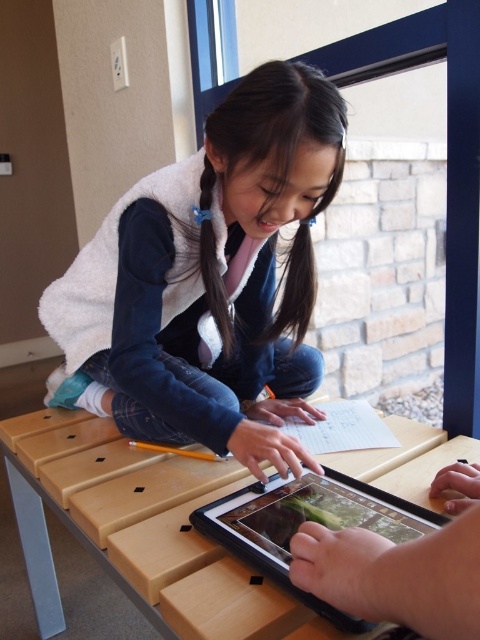
You are a student who needs to place a textbook on the wooden table at center. However, there is a black glossy tablet at lower center already on it. Can you place the textbook there without moving the tablet?

The wooden table at center is below the black glossy tablet at lower center, meaning the tablet is placed on top of the table. Therefore, you can place the textbook on the wooden table at center alongside the tablet as long as there is enough space.

You are trying to determine if the white fleece vest at center can be placed on top of the wooden table at center. Based on their thickness, can the vest fit on the table?

The white fleece vest at center is thinner than the wooden table at center, so it can fit on top of the wooden table at center since its thickness is less than the table.

You are a student who needs to place a notebook on the wooden table at center and the black glossy tablet at lower center. Which surface will the notebook require more effort to place due to height?

The wooden table at center is taller than the black glossy tablet at lower center, so placing the notebook on the wooden table at center will require more effort due to its greater height.